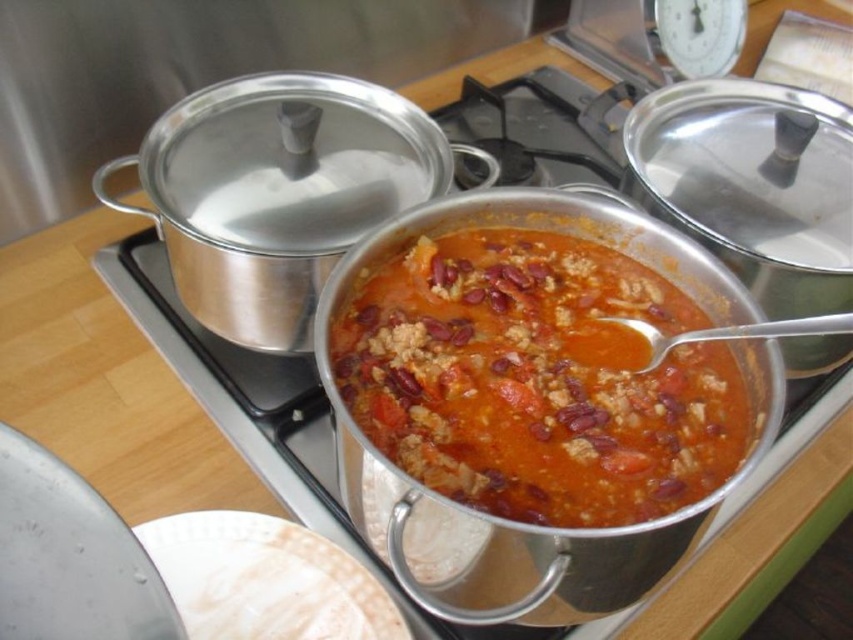
Can you confirm if white matte plate at lower left is positioned above silver metallic spoon at center?

Incorrect, white matte plate at lower left is not positioned above silver metallic spoon at center.

Who is more distant from viewer, (264, 632) or (616, 323)?

The point (616, 323) is behind.

This screenshot has width=853, height=640. Find the location of `white matte plate at lower left`. white matte plate at lower left is located at coordinates (265, 579).

Who is lower down, tomato-based stew at center or white matte plate at lower left?

Positioned lower is white matte plate at lower left.

Between tomato-based stew at center and white matte plate at lower left, which one has more height?

Standing taller between the two is tomato-based stew at center.

Does point (527, 294) lie in front of point (302, 534)?

No, (527, 294) is further to viewer.

Identify the location of tomato-based stew at center. This screenshot has width=853, height=640. (537, 380).

The image size is (853, 640). What do you see at coordinates (537, 380) in the screenshot?
I see `tomato-based stew at center` at bounding box center [537, 380].

Which is more to the right, tomato-based stew at center or silver metallic spoon at center?

Positioned to the right is silver metallic spoon at center.

Does point (590, 269) come behind point (764, 326)?

Yes, it is.

Find the location of `tomato-based stew at center`. tomato-based stew at center is located at coordinates (537, 380).